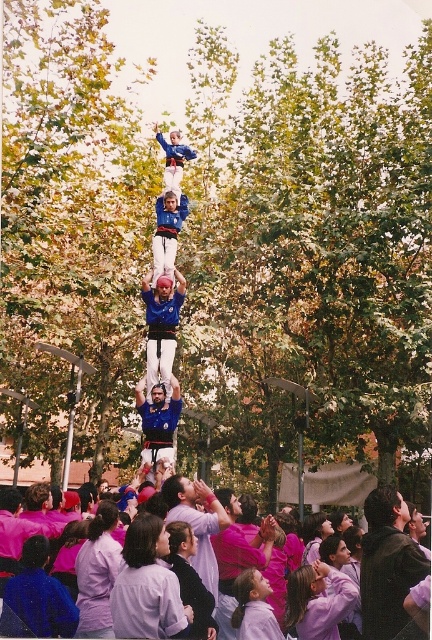
Question: In this image, where is dark brown leather jacket at center located relative to pink fabric crowd at lower center?

Choices:
 (A) above
 (B) below

Answer: (A)

Question: Does dark brown leather jacket at center come in front of blue fabric man at center?

Choices:
 (A) yes
 (B) no

Answer: (A)

Question: Among these objects, which one is nearest to the camera?

Choices:
 (A) blue fabric man at center
 (B) dark brown leather jacket at center

Answer: (B)

Question: Among these points, which one is nearest to the camera?

Choices:
 (A) (165, 417)
 (B) (206, 486)
 (C) (158, 280)
 (D) (237, 624)

Answer: (D)

Question: Which is farther from the pink fabric crowd at lower center?

Choices:
 (A) blue fabric shirt at center
 (B) blue fabric man at center

Answer: (A)

Question: Is blue fabric shirt at center above blue fabric man at center?

Choices:
 (A) yes
 (B) no

Answer: (A)